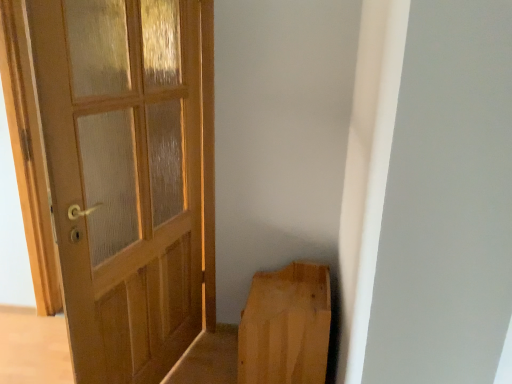
Identify the location of light brown wood at lower right. (286, 326).

What do you see at coordinates (286, 326) in the screenshot?
I see `light brown wood at lower right` at bounding box center [286, 326].

You are a GUI agent. You are given a task and a screenshot of the screen. Output one action in this format:
    pyautogui.click(x=<x>, y=<y>)
    Task: Click on the wooden door at left
    
    Given the screenshot: What is the action you would take?
    pyautogui.click(x=129, y=176)

What do you see at coordinates (129, 176) in the screenshot? Image resolution: width=512 pixels, height=384 pixels. I see `wooden door at left` at bounding box center [129, 176].

The width and height of the screenshot is (512, 384). What are the coordinates of `light brown wood at lower right` in the screenshot? It's located at (286, 326).

Between light brown wood at lower right and wooden door at left, which one appears on the left side from the viewer's perspective?

From the viewer's perspective, wooden door at left appears more on the left side.

Is the depth of light brown wood at lower right less than that of wooden door at left?

No, it is not.

Is point (277, 331) farther from viewer compared to point (110, 316)?

That is True.

From the image's perspective, is light brown wood at lower right above or below wooden door at left?

Clearly, from the image's perspective, light brown wood at lower right is below wooden door at left.

In the scene shown: From a real-world perspective, between light brown wood at lower right and wooden door at left, who is vertically lower?

light brown wood at lower right.

Considering the relative sizes of light brown wood at lower right and wooden door at left in the image provided, is light brown wood at lower right thinner than wooden door at left?

In fact, light brown wood at lower right might be wider than wooden door at left.

Which of these two, light brown wood at lower right or wooden door at left, stands taller?

With more height is wooden door at left.

Who is bigger, light brown wood at lower right or wooden door at left?

With larger size is wooden door at left.

Would you say light brown wood at lower right is inside or outside wooden door at left?

light brown wood at lower right is outside wooden door at left.

Is light brown wood at lower right not near wooden door at left?

light brown wood at lower right is near wooden door at left, not far away.

Is light brown wood at lower right looking in the opposite direction of wooden door at left?

light brown wood at lower right does not have its back to wooden door at left.

How different are the orientations of light brown wood at lower right and wooden door at left in degrees?

The angular difference between light brown wood at lower right and wooden door at left is 13.9 degrees.

Locate an element on the screen. door located above the light brown wood at lower right (from the image's perspective) is located at coordinates (129, 176).

Considering the positions of objects wooden door at left and light brown wood at lower right in the image provided, who is more to the right, wooden door at left or light brown wood at lower right?

light brown wood at lower right is more to the right.

Is wooden door at left in front of or behind light brown wood at lower right in the image?

wooden door at left is in front of light brown wood at lower right.

Is point (191, 16) closer or farther from the camera than point (283, 292)?

Point (191, 16) appears to be closer to the viewer than point (283, 292).

From the image's perspective, would you say wooden door at left is shown under light brown wood at lower right?

Actually, wooden door at left appears above light brown wood at lower right in the image.

From a real-world perspective, is wooden door at left positioned over light brown wood at lower right based on gravity?

Yes, from a real-world perspective, wooden door at left is over light brown wood at lower right

Considering the sizes of objects wooden door at left and light brown wood at lower right in the image provided, who is thinner, wooden door at left or light brown wood at lower right?

wooden door at left is thinner.

Can you confirm if wooden door at left is taller than light brown wood at lower right?

Yes.

Considering the relative sizes of wooden door at left and light brown wood at lower right in the image provided, is wooden door at left smaller than light brown wood at lower right?

Incorrect, wooden door at left is not smaller in size than light brown wood at lower right.

Is light brown wood at lower right a part of wooden door at left?

No, wooden door at left does not contain light brown wood at lower right.

Would you consider wooden door at left to be distant from light brown wood at lower right?

That's not correct — wooden door at left is a little close to light brown wood at lower right.

Could you tell me if wooden door at left is facing light brown wood at lower right?

No, wooden door at left is not turned towards light brown wood at lower right.

What's the angular difference between wooden door at left and light brown wood at lower right's facing directions?

There is a 13.9-degree angle between the facing directions of wooden door at left and light brown wood at lower right.

In order to click on furniture that is on the right side of wooden door at left in this screenshot , I will do `click(286, 326)`.

You are a GUI agent. You are given a task and a screenshot of the screen. Output one action in this format:
    pyautogui.click(x=<x>, y=<y>)
    Task: Click on the door on the left side of light brown wood at lower right
    The height and width of the screenshot is (384, 512).
    Given the screenshot: What is the action you would take?
    pyautogui.click(x=129, y=176)

Locate an element on the screen. The image size is (512, 384). furniture lying on the right of wooden door at left is located at coordinates (286, 326).